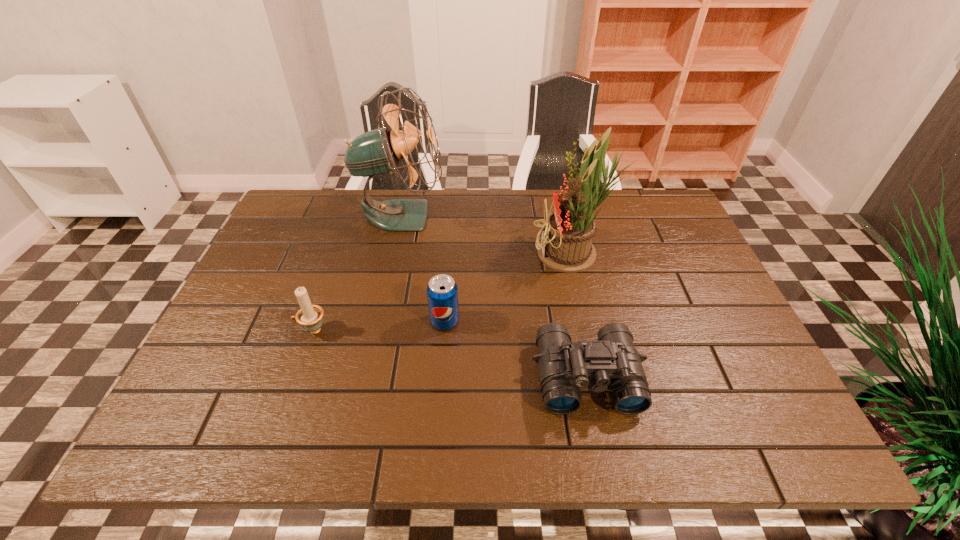
I want to click on vacant area that satisfies the following two spatial constraints: 1. on the front-facing side of the fan for air flow; 2. on the back side of the pop soda, so click(x=378, y=322).

Find the location of `free space that satisfies the following two spatial constraints: 1. in front of the flower arrangement with the fan visible; 2. through the lenses of the nearest object`. free space that satisfies the following two spatial constraints: 1. in front of the flower arrangement with the fan visible; 2. through the lenses of the nearest object is located at coordinates (602, 377).

This screenshot has width=960, height=540. What are the coordinates of `free point that satisfies the following two spatial constraints: 1. on the front-facing side of the fan for air flow; 2. on the back side of the pop soda` in the screenshot? It's located at [378, 322].